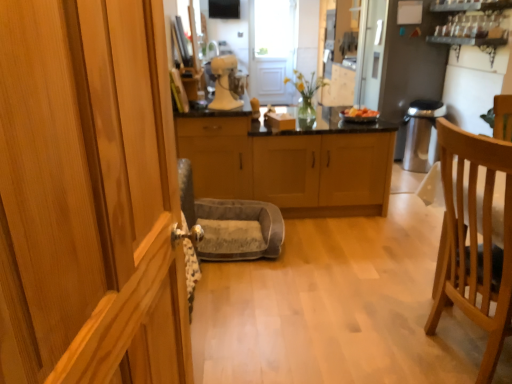
Where is `vacant area located to the right-hand side of velvet gray pet bed at center`? vacant area located to the right-hand side of velvet gray pet bed at center is located at coordinates (320, 247).